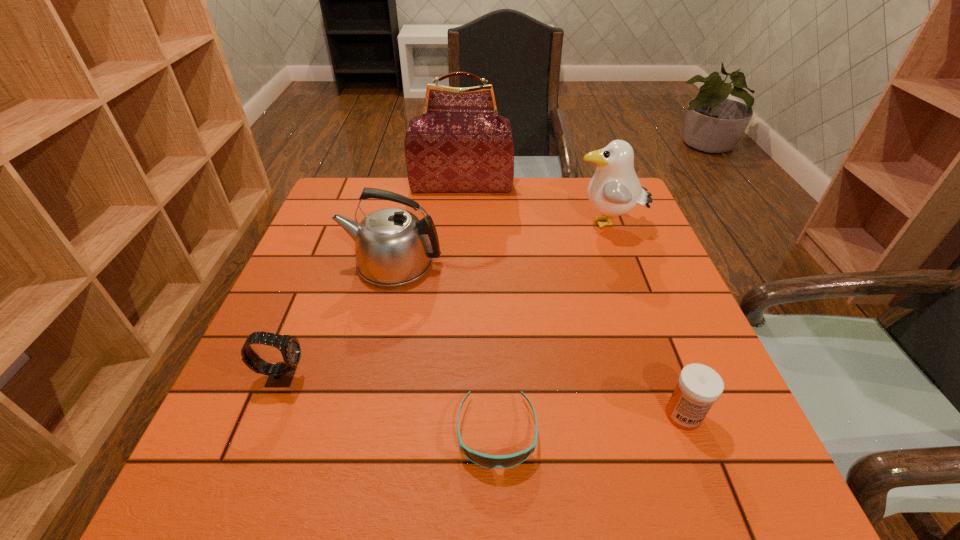
I want to click on vacant space located on the beak of the gull, so click(x=518, y=225).

The image size is (960, 540). Identify the location of free point located on the spout of the fourth shortest object. (320, 264).

Find the location of a particular element. vacant space situated on the spout of the fourth shortest object is located at coordinates (320, 264).

This screenshot has width=960, height=540. Identify the location of vacant region located 0.180m on the face of the third nearest object. (399, 376).

This screenshot has width=960, height=540. What are the coordinates of `vacant space situated on the back of the medicine` in the screenshot? It's located at (660, 352).

Identify the location of handbag that is at the far edge. The width and height of the screenshot is (960, 540). (460, 143).

Where is `gull located at the far edge`? Image resolution: width=960 pixels, height=540 pixels. gull located at the far edge is located at coordinates (614, 190).

You are a GUI agent. You are given a task and a screenshot of the screen. Output one action in this format:
    pyautogui.click(x=<x>, y=<y>)
    Task: Click on the object that is at the near edge
    
    Given the screenshot: What is the action you would take?
    pyautogui.click(x=487, y=461)

Where is `kettle positioned at the left edge`? Image resolution: width=960 pixels, height=540 pixels. kettle positioned at the left edge is located at coordinates (393, 247).

I want to click on watch at the left edge, so (x=281, y=374).